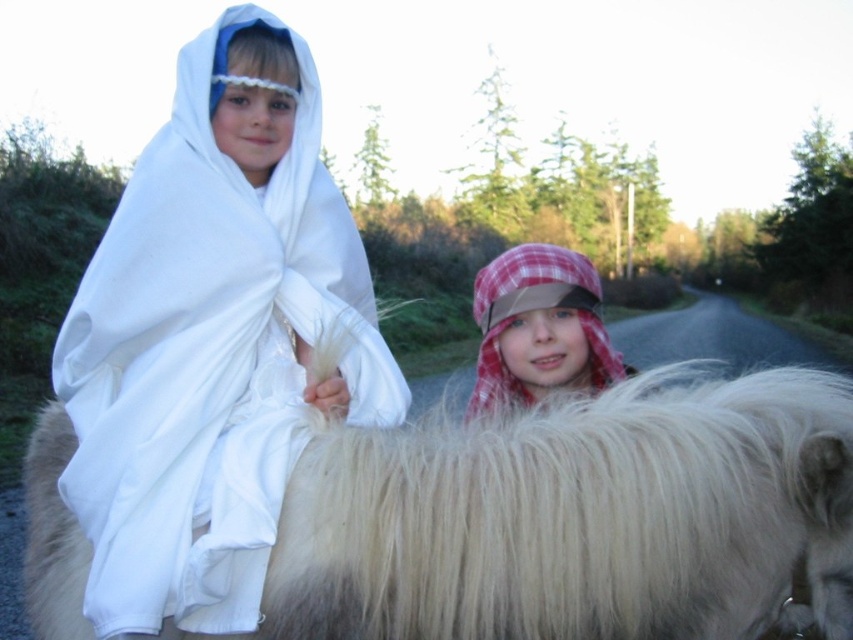
You are a photographer trying to capture a closeup shot of both the fluffy white horse at center and the plaid fabric hat at center. Given that your camera can only focus on objects within a 25 inch range, will you be able to capture both in focus?

The fluffy white horse at center and plaid fabric hat at center are 30.71 inches apart from each other. Since the distance exceeds the camera focus range of 25 inches, you cannot capture both in focus simultaneously.

You are a photographer setting up a shot with the fluffy white horse at center and the white cloth at upper left. Which object is shorter?

The fluffy white horse at center is shorter than the white cloth at upper left.

You are a photographer trying to capture a clear shot of both the white cloth at upper left and the plaid fabric hat at center. Which object should you focus on first to ensure both are in focus?

The white cloth at upper left is closer to the viewer than the plaid fabric hat at center, so focusing on the white cloth at upper left first will help ensure both are in focus since it is the closer object.